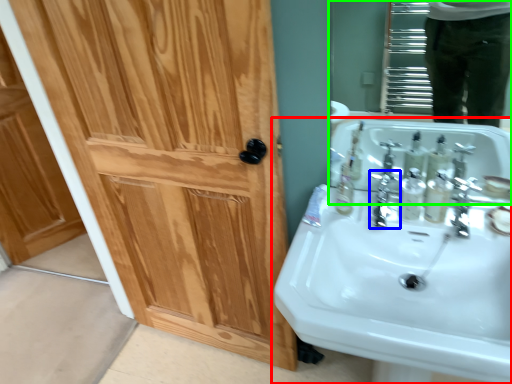
Question: Estimate the real-world distances between objects in this image. Which object is farther from sink (highlighted by a red box), plumbing fixture (highlighted by a blue box) or mirror (highlighted by a green box)?

Choices:
 (A) plumbing fixture
 (B) mirror

Answer: (B)